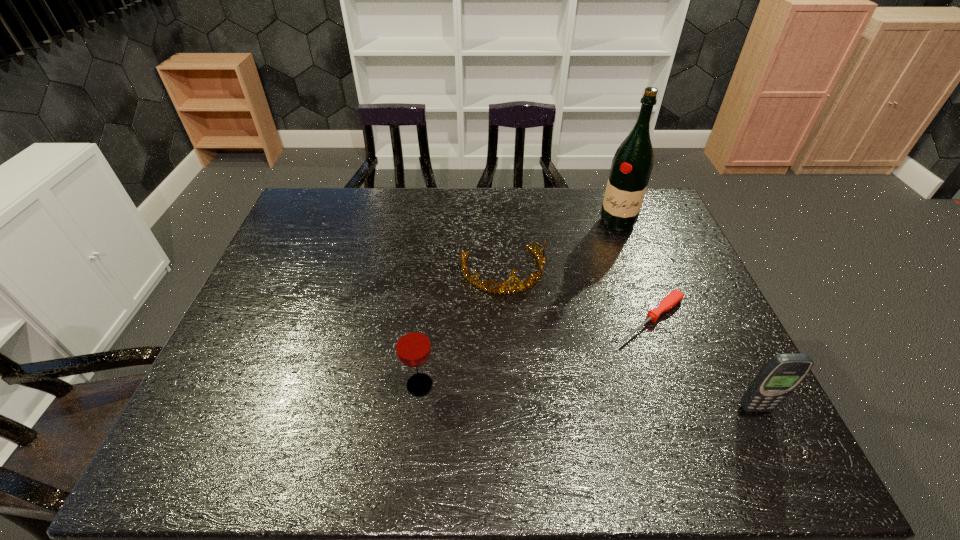
In the image, there is a desktop. Where is `free space at the far left corner`? The width and height of the screenshot is (960, 540). free space at the far left corner is located at coordinates (298, 224).

The image size is (960, 540). Find the location of `free space at the near left corner`. free space at the near left corner is located at coordinates (223, 389).

This screenshot has width=960, height=540. I want to click on vacant space at the far right corner of the desktop, so click(643, 224).

The width and height of the screenshot is (960, 540). What are the coordinates of `unoccupied area between the tallest object and the glass` in the screenshot? It's located at (518, 303).

Locate an element on the screen. This screenshot has width=960, height=540. unoccupied position between the second shortest object and the screwdriver is located at coordinates (577, 295).

Locate an element on the screen. The width and height of the screenshot is (960, 540). vacant area that lies between the screwdriver and the leftmost object is located at coordinates (536, 352).

Where is `empty location between the shortest object and the tiara`? empty location between the shortest object and the tiara is located at coordinates (577, 295).

The width and height of the screenshot is (960, 540). Find the location of `free area in between the cellular telephone and the leftmost object`. free area in between the cellular telephone and the leftmost object is located at coordinates (588, 396).

The height and width of the screenshot is (540, 960). In order to click on unoccupied position between the glass and the liquor in this screenshot , I will do `click(518, 303)`.

The image size is (960, 540). What are the coordinates of `free area in between the leftmost object and the tiara` in the screenshot? It's located at (461, 328).